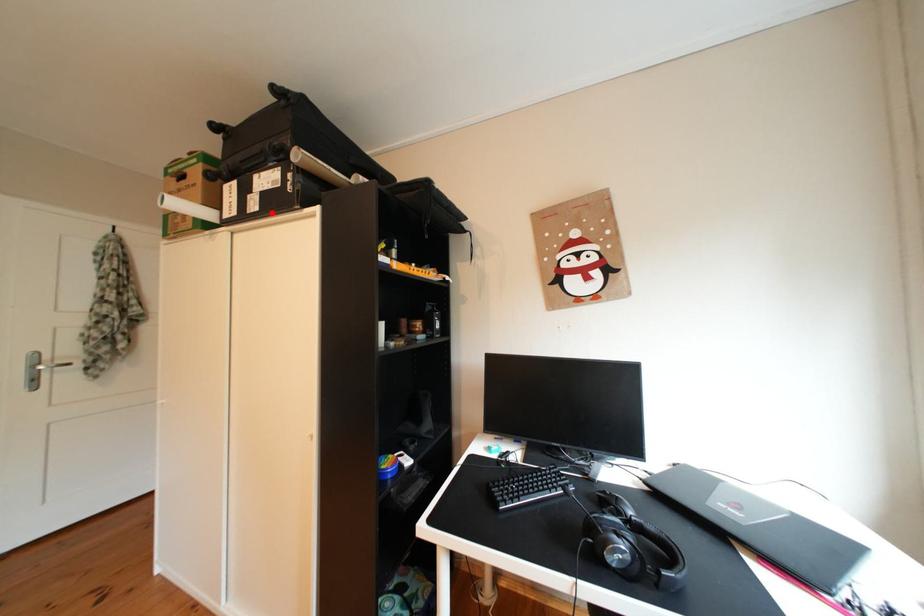
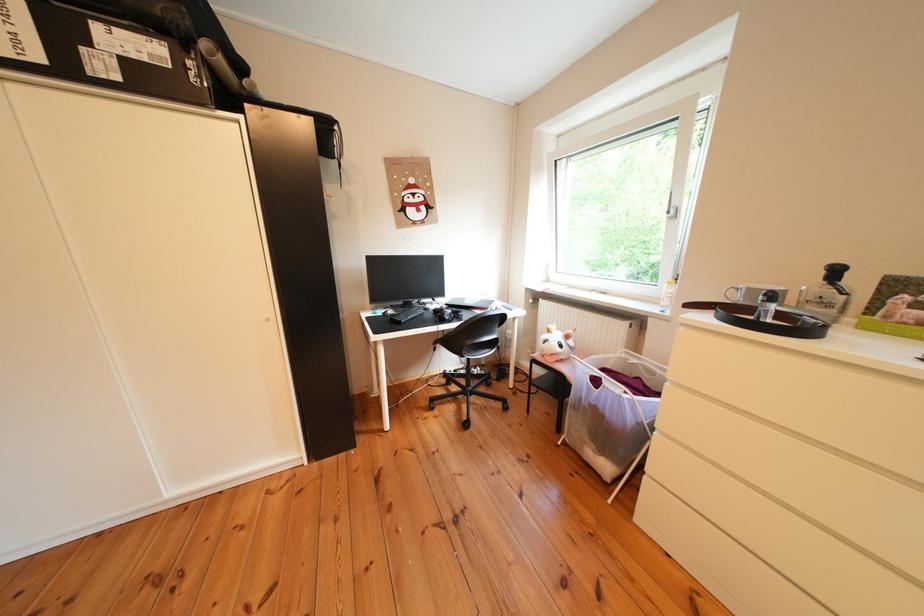
Question: I am providing you with two images of the same scene from different viewpoints. In image1, a red point is highlighted. Considering the same 3D point in image2, which of the following is correct?

Choices:
 (A) It is closer
 (B) It is farther

Answer: (B)